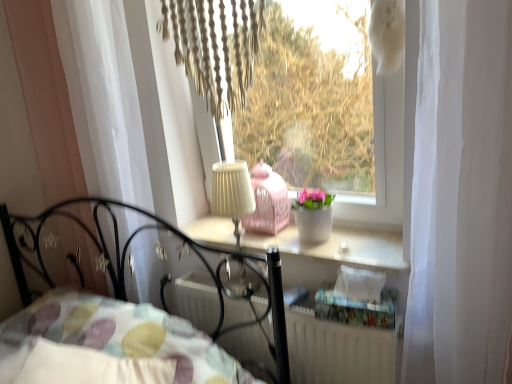
Where is `vacant region above white textured radiator at lower center (from a real-world perspective)`? The image size is (512, 384). vacant region above white textured radiator at lower center (from a real-world perspective) is located at coordinates (266, 291).